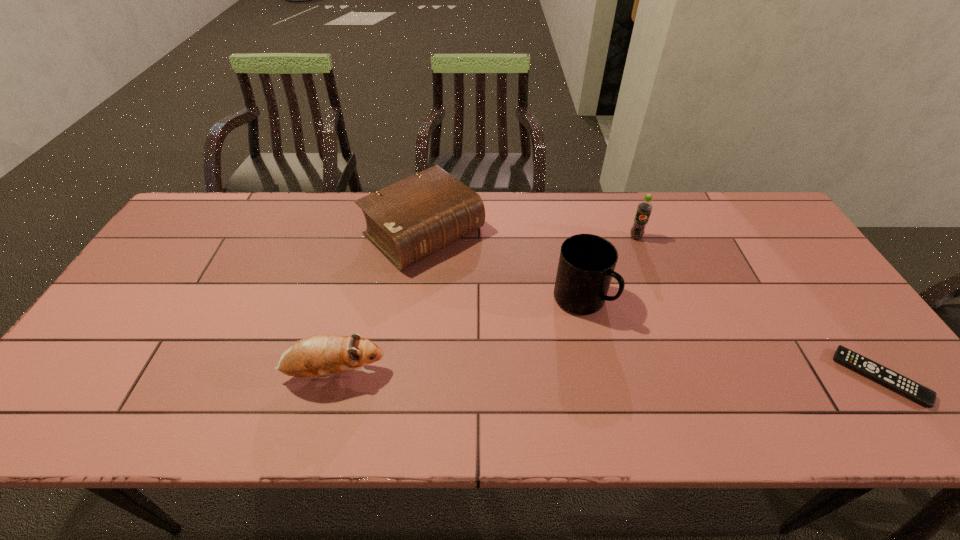
You are a GUI agent. You are given a task and a screenshot of the screen. Output one action in this format:
    pyautogui.click(x=<x>, y=<y>)
    Task: Click on the free space between the rightmost object and the third nearest object
    
    Given the screenshot: What is the action you would take?
    pyautogui.click(x=730, y=339)

The image size is (960, 540). Identify the location of free space between the rightmost object and the Bible. (652, 305).

The height and width of the screenshot is (540, 960). I want to click on empty space between the Bible and the remote control, so click(652, 305).

Identify the location of vacant space in between the hamster and the second object from right to left. (485, 306).

You are a GUI agent. You are given a task and a screenshot of the screen. Output one action in this format:
    pyautogui.click(x=<x>, y=<y>)
    Task: Click on the empty space that is in between the hamster and the third object from left to right
    The height and width of the screenshot is (540, 960).
    Given the screenshot: What is the action you would take?
    pyautogui.click(x=458, y=337)

Where is `empty location between the Bible and the soda`? The width and height of the screenshot is (960, 540). empty location between the Bible and the soda is located at coordinates (530, 235).

Find the location of a particular element. free point between the Bible and the hamster is located at coordinates (379, 303).

Where is `object that is the fourth closest to the fourth object from left to right`? object that is the fourth closest to the fourth object from left to right is located at coordinates (318, 356).

Identify which object is the closest to the Bible. Please provide its 2D coordinates. Your answer should be formatted as a tuple, i.e. [(x, y)], where the tuple contains the x and y coordinates of a point satisfying the conditions above.

[(586, 266)]

This screenshot has width=960, height=540. Identify the location of vacant position in the image that satisfies the following two spatial constraints: 1. on the front side of the rightmost object; 2. on the left side of the third object from right to left. (597, 378).